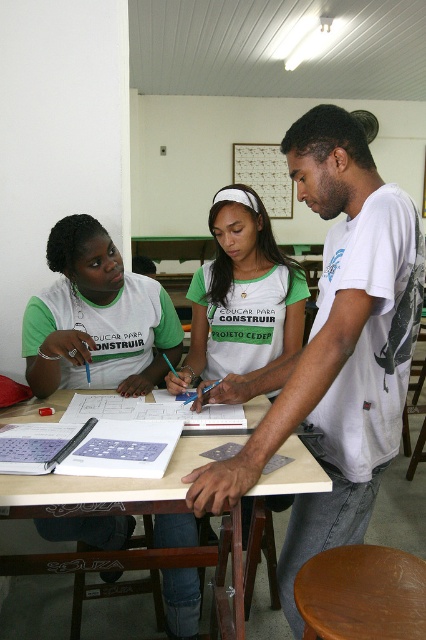
Does brown wooden stool at lower right have a lesser width compared to metallic grid at upper center?

Yes, brown wooden stool at lower right is thinner than metallic grid at upper center.

Who is more distant from viewer, (334, 552) or (270, 170)?

Positioned behind is point (270, 170).

Find the location of a particular element. brown wooden stool at lower right is located at coordinates (362, 593).

Where is `brown wooden stool at lower right`? brown wooden stool at lower right is located at coordinates (362, 593).

Can you confirm if white t-shirt at center is bigger than green matte shirt at center?

Yes, white t-shirt at center is bigger than green matte shirt at center.

Does white t-shirt at center appear under green matte shirt at center?

Indeed, white t-shirt at center is positioned under green matte shirt at center.

Is point (342, 188) positioned before point (247, 307)?

Yes, it is in front of point (247, 307).

You are a GUI agent. You are given a task and a screenshot of the screen. Output one action in this format:
    pyautogui.click(x=<x>, y=<y>)
    Task: Click on the white t-shirt at center
    
    Given the screenshot: What is the action you would take?
    pyautogui.click(x=334, y=348)

Can you confirm if green fabric shirt at left is thinner than metallic grid at upper center?

Correct, green fabric shirt at left's width is less than metallic grid at upper center's.

Is green fabric shirt at left to the left of metallic grid at upper center from the viewer's perspective?

Yes, green fabric shirt at left is to the left of metallic grid at upper center.

Which is in front, point (154, 282) or point (279, 202)?

Point (154, 282) is in front.

What are the coordinates of `green fabric shirt at left` in the screenshot? It's located at (97, 317).